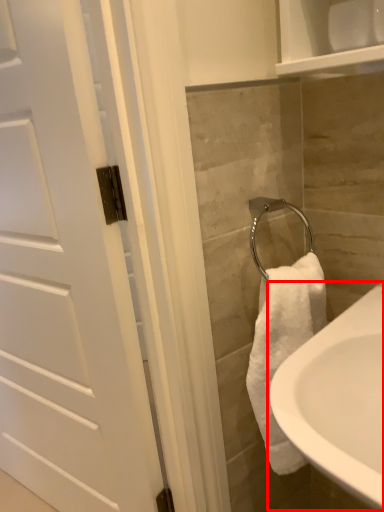
Question: Observing the image, what is the correct spatial positioning of sink (annotated by the red box) in reference to door?

Choices:
 (A) left
 (B) right

Answer: (B)